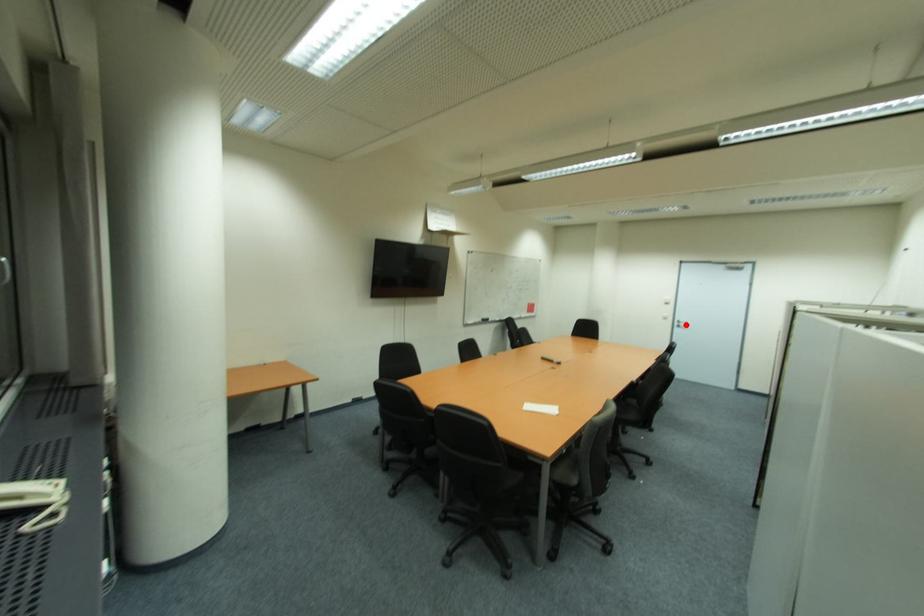
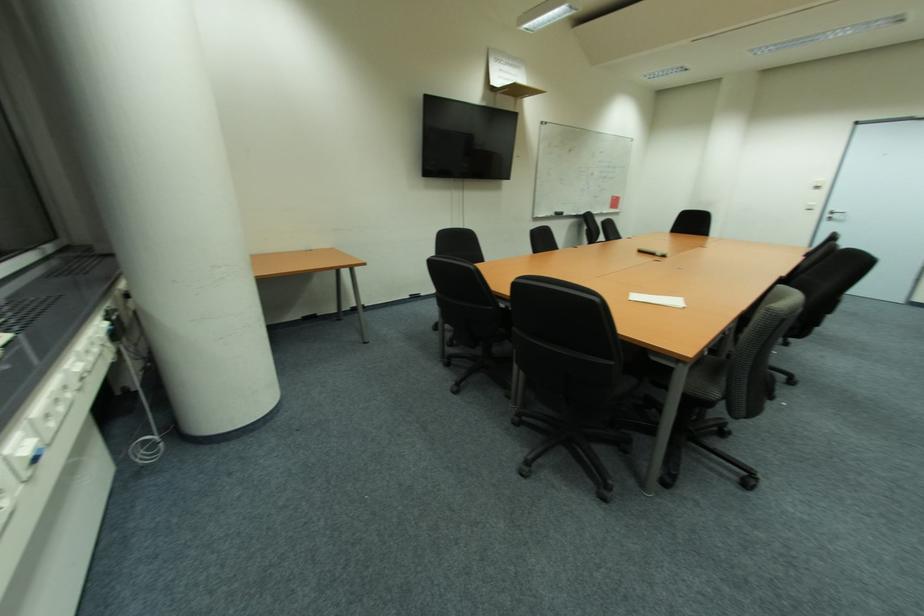
The point at the highlighted location is marked in the first image. Where is the corresponding point in the second image?

(842, 217)